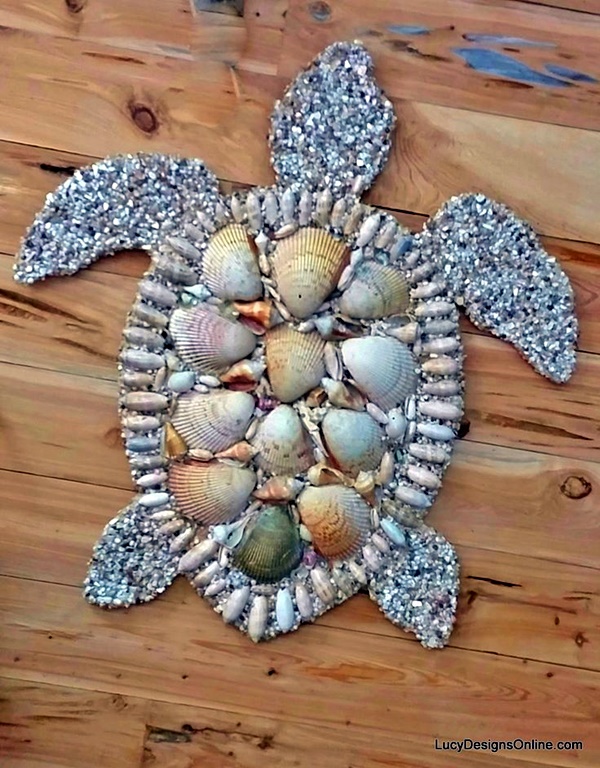
You are a GUI agent. You are given a task and a screenshot of the screen. Output one action in this format:
    pyautogui.click(x=<x>, y=<y>)
    Task: Click on the knots in wood
    The height and width of the screenshot is (768, 600).
    Given the screenshot: What is the action you would take?
    pyautogui.click(x=572, y=488), pyautogui.click(x=151, y=114), pyautogui.click(x=319, y=15), pyautogui.click(x=71, y=8)